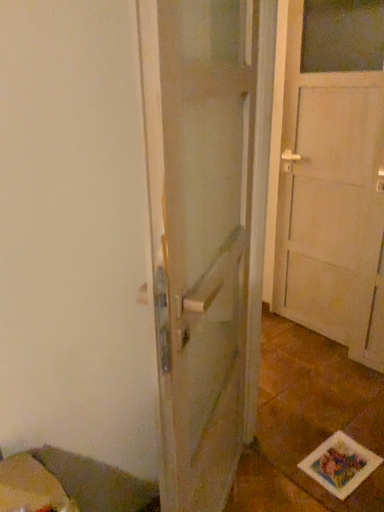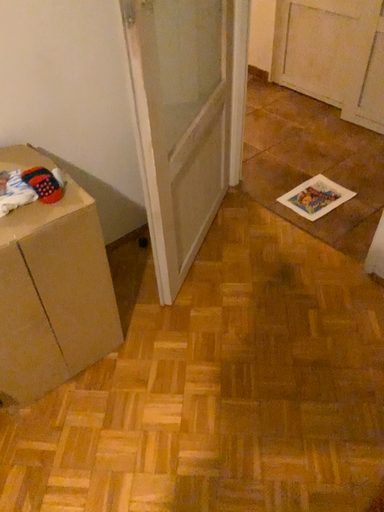
Question: Which way did the camera rotate in the video?

Choices:
 (A) rotated upward
 (B) rotated downward

Answer: (B)